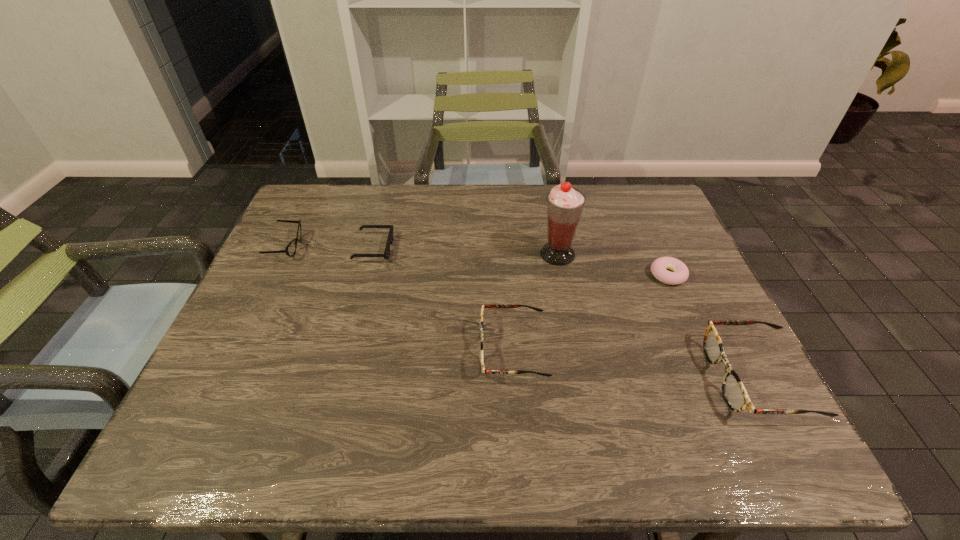
The height and width of the screenshot is (540, 960). Find the location of `spectacles at the right edge`. spectacles at the right edge is located at coordinates (734, 392).

This screenshot has width=960, height=540. In order to click on doughnut located at the right edge in this screenshot , I will do `click(680, 274)`.

Find the location of a particular element. object located in the near right corner section of the desktop is located at coordinates (734, 392).

I want to click on vacant region at the far edge of the desktop, so click(512, 225).

Identify the location of blank space at the near edge. This screenshot has width=960, height=540. (285, 393).

Identify the location of free space at the left edge. (251, 313).

Where is `free space at the right edge`? free space at the right edge is located at coordinates (677, 249).

The height and width of the screenshot is (540, 960). Find the location of `free space at the far left corner`. free space at the far left corner is located at coordinates (332, 220).

This screenshot has width=960, height=540. Identify the location of free space between the doughnut and the smoothie. (612, 265).

You are a GUI agent. You are given a task and a screenshot of the screen. Output one action in this format:
    pyautogui.click(x=<x>, y=<y>)
    Task: Click on the free space between the doughnut and the leftmost spectacles
    
    Given the screenshot: What is the action you would take?
    pyautogui.click(x=477, y=261)